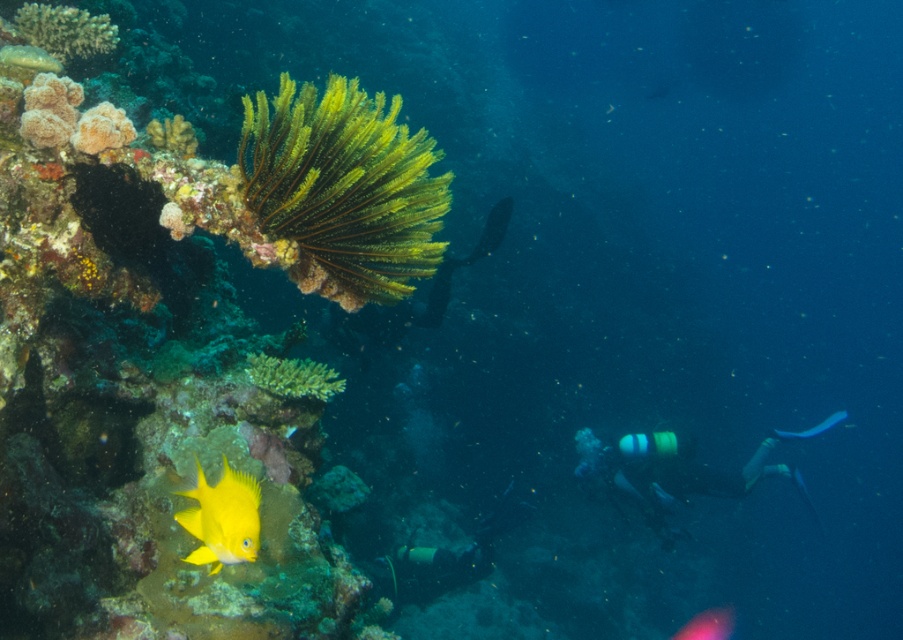
Question: Is rough textured coral at upper left positioned behind yellow matte fish at lower left?

Choices:
 (A) no
 (B) yes

Answer: (A)

Question: Which point is farther to the camera?

Choices:
 (A) (286, 168)
 (B) (43, 28)

Answer: (B)

Question: Estimate the real-world distances between objects in this image. Which object is closer to the yellow matte fish at lower left?

Choices:
 (A) rough textured coral at upper left
 (B) shiny yellow fish at lower left
 (C) yellow coral reef at lower left

Answer: (C)

Question: Which point is closer to the camera taking this photo?

Choices:
 (A) 122,456
 (B) 364,118

Answer: (B)

Question: Does shiny yellow fish at lower left appear under yellow matte fish at lower left?

Choices:
 (A) yes
 (B) no

Answer: (B)

Question: Is yellow coral reef at lower left closer to camera compared to rough textured coral at upper left?

Choices:
 (A) yes
 (B) no

Answer: (A)